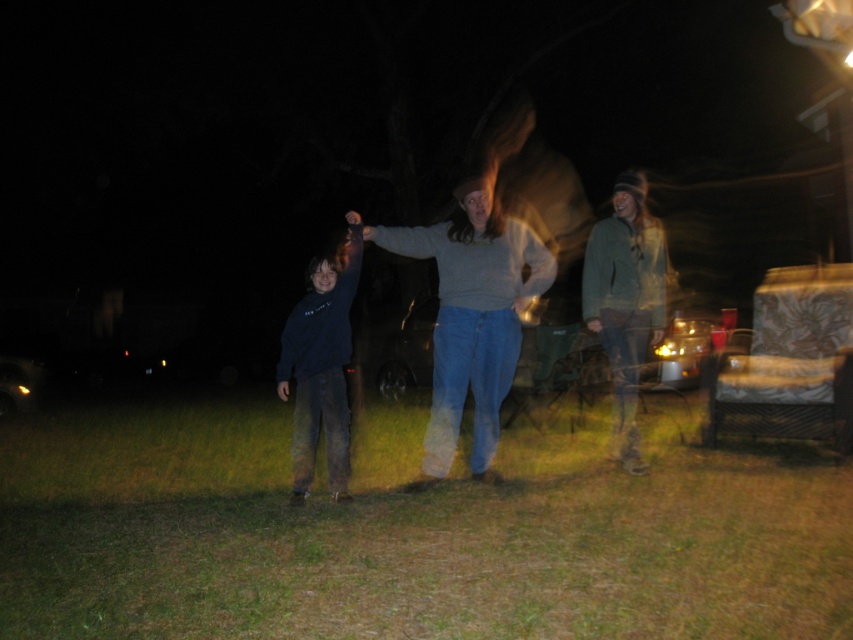
Question: Estimate the real-world distances between objects in this image. Which object is closer to the green textured jacket at center?

Choices:
 (A) dark blue sweatshirt at center
 (B) gray sweater at center
 (C) green grass at lower center

Answer: (B)

Question: Considering the relative positions of gray sweater at center and dark blue sweatshirt at center in the image provided, where is gray sweater at center located with respect to dark blue sweatshirt at center?

Choices:
 (A) above
 (B) below

Answer: (A)

Question: Is gray sweater at center wider than dark blue sweatshirt at center?

Choices:
 (A) no
 (B) yes

Answer: (B)

Question: Estimate the real-world distances between objects in this image. Which object is closer to the green grass at lower center?

Choices:
 (A) green textured jacket at center
 (B) dark blue sweatshirt at center
 (C) gray sweater at center

Answer: (B)

Question: Which point is farther from the camera taking this photo?

Choices:
 (A) pyautogui.click(x=483, y=579)
 (B) pyautogui.click(x=506, y=289)
 (C) pyautogui.click(x=633, y=368)
 (D) pyautogui.click(x=289, y=372)

Answer: (C)

Question: Does green grass at lower center lie behind dark blue sweatshirt at center?

Choices:
 (A) yes
 (B) no

Answer: (B)